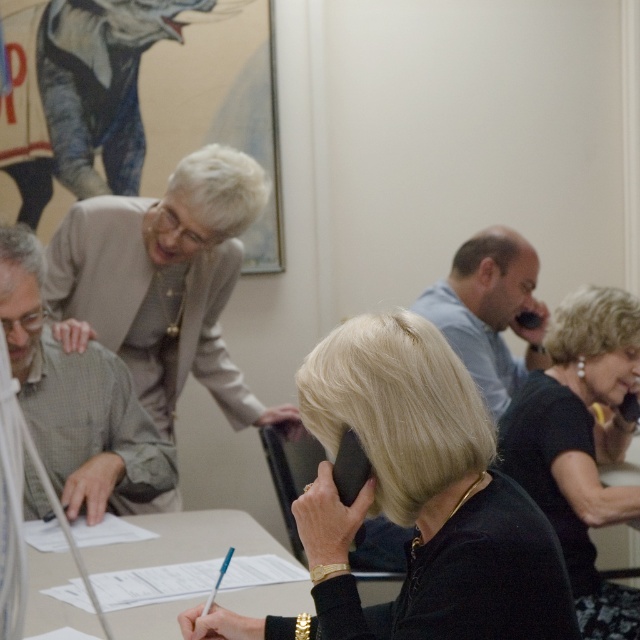
You are standing at the entrance of the conference room and want to move towards the point at coordinates point (417, 461) and point (161, 557). Which point will you reach first?

Point (417, 461) is in front of point (161, 557), so you will reach point (417, 461) first.

You are standing in the conference room and want to know where the point at coordinates (580, 444) is located. According to the scene description, can you identify which object this point is on?

The point at coordinates (580, 444) is on the black matte dress at lower right.

You are standing in the conference room and want to pick up the black matte phone at center without moving from your current position. Can you reach it?

The black matte phone at center is 3.67 feet away from the camera, so if you are standing at the camera position, you cannot reach it without moving closer.